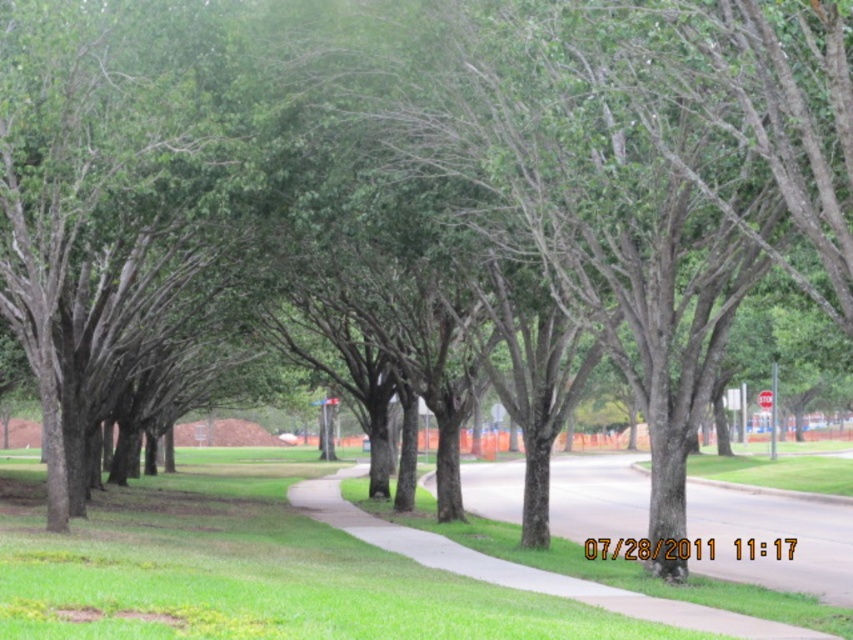
You are a gardener planning to mow the lawn. You see the green grass at center and the gray asphalt pavement at center. Which area requires mowing?

The green grass at center requires mowing because it is a grassy area, while the gray asphalt pavement at center is an impermeable surface that doesn

You are a pedestrian walking on the sidewalk and want to cross the road to reach a friend waiting on the other side. You notice the green grass at center and the gray asphalt pavement at center. Which surface should you step onto to avoid the asphalt?

You should step onto the green grass at center because it is located above the gray asphalt pavement at center, meaning it is the grassy area between the sidewalk and the road, not the actual road surface.

You are standing on the sidewalk in the suburban scene and want to walk towards the construction site in the background. Which point, point (364,589) or point (795,516), is closer to you as you face the construction site?

Point (364,589) is closer to the viewer than point (795,516), so it is the closer point as you face the construction site.